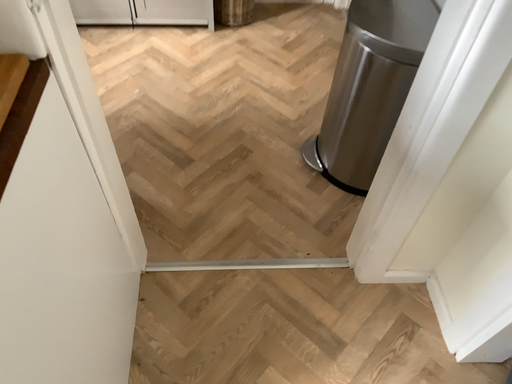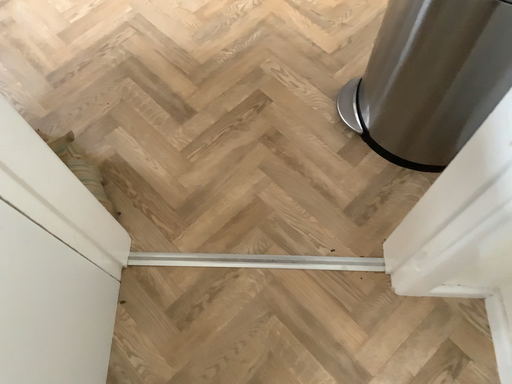
Question: How did the camera likely rotate when shooting the video?

Choices:
 (A) rotated downward
 (B) rotated upward

Answer: (A)